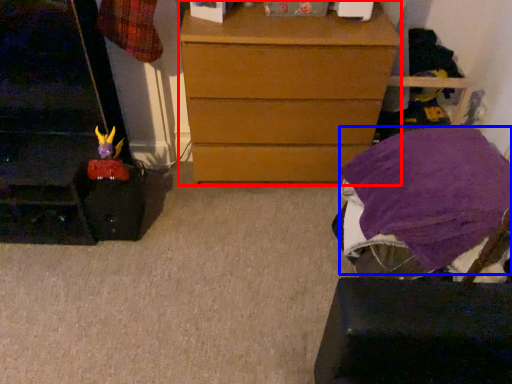
Question: Which object is closer to the camera taking this photo, chest of drawers (highlighted by a red box) or blanket (highlighted by a blue box)?

Choices:
 (A) chest of drawers
 (B) blanket

Answer: (B)